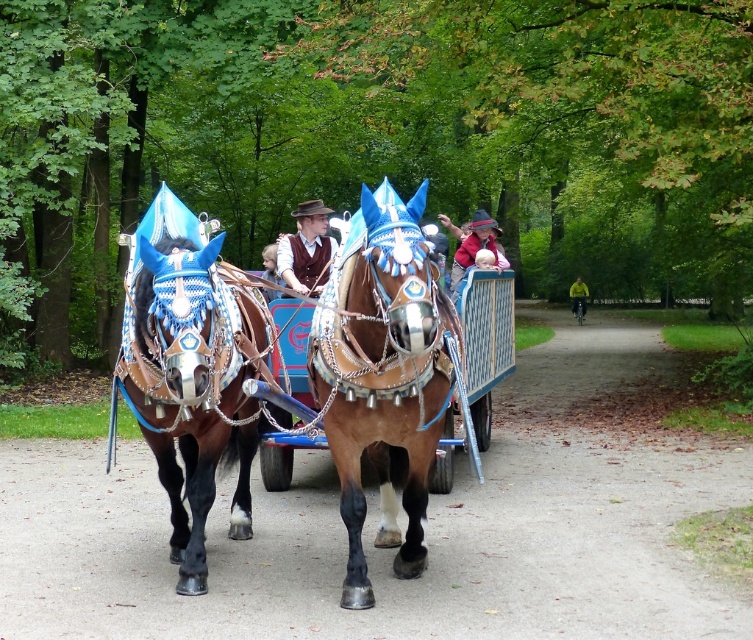
You are standing in the forest and see the shiny brown cart at center. Can you determine its exact coordinates based on the scene?

The shiny brown cart at center is located at point [386,371].

You are standing in the forest and see the point at coordinates (413, 396). If you walk 6 meters forward, will you reach that point?

The point at coordinates (413, 396) is 6.65 meters away from the viewer. Walking 6 meters forward would not reach it, as you would still be 0.65 meters short.

You are a passenger in the shiny brown cart at center pulled by the brown shiny horse at center. You want to know if you can stand up inside the cart without hitting your head. Can you?

The shiny brown cart at center is shorter than the brown shiny horse at center, so the cart has limited headroom. If the cart is shorter than the horse, it might not provide enough vertical space for you to stand up without hitting your head. Therefore, it is advisable to remain seated to avoid discomfort.